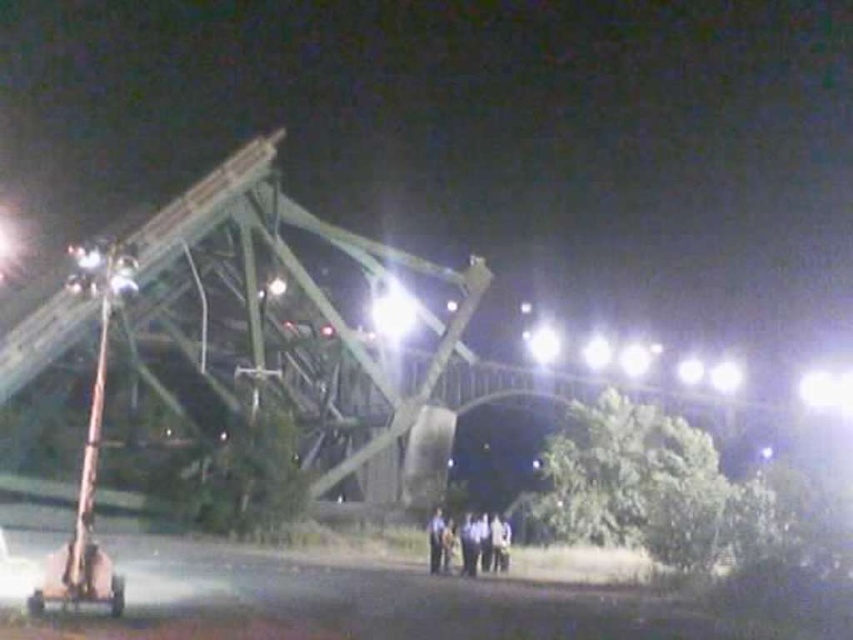
Question: Among these points, which one is nearest to the camera?

Choices:
 (A) (463, 522)
 (B) (9, 602)

Answer: (B)

Question: Can you confirm if dark blue uniform at lower center is positioned to the left of metallic silver car at lower left?

Choices:
 (A) no
 (B) yes

Answer: (A)

Question: Does dark blue uniform at lower center have a lesser width compared to metallic silver car at lower left?

Choices:
 (A) no
 (B) yes

Answer: (B)

Question: From the image, what is the correct spatial relationship of dark blue uniform at lower center in relation to metallic silver car at lower left?

Choices:
 (A) left
 (B) right

Answer: (B)